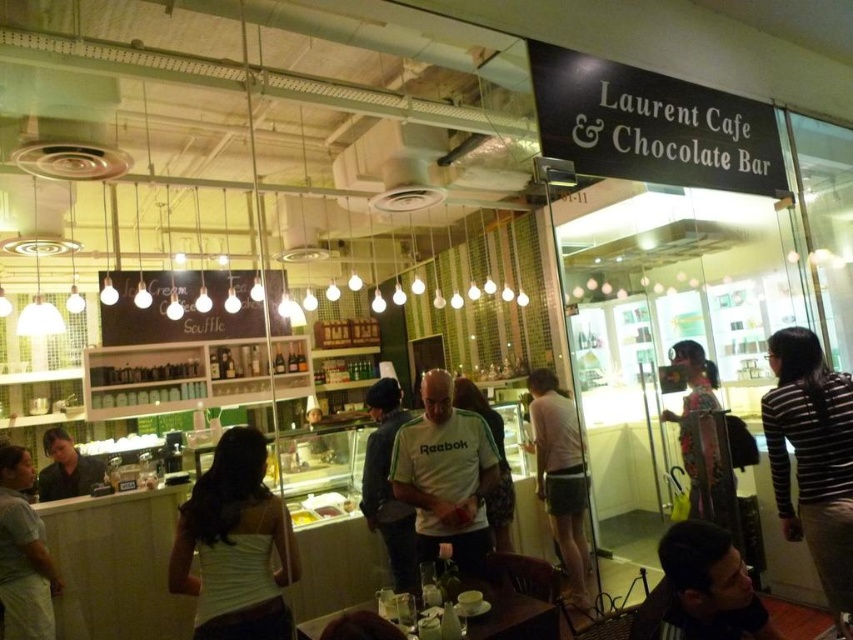
Question: Which object is the farthest from the striped sweater at right?

Choices:
 (A) white cotton shirt at center
 (B) white fabric tank top at center

Answer: (B)

Question: Is white fabric shirt at lower center positioned behind white cotton t-shirt at center?

Choices:
 (A) yes
 (B) no

Answer: (B)

Question: Can you confirm if white reebok shirt at center is thinner than white cotton t-shirt at center?

Choices:
 (A) no
 (B) yes

Answer: (B)

Question: Among these objects, which one is farthest from the camera?

Choices:
 (A) white cotton shirt at center
 (B) striped sweater at right
 (C) white fabric tank top at center

Answer: (A)

Question: Is white reebok shirt at center behind white cotton t-shirt at center?

Choices:
 (A) no
 (B) yes

Answer: (B)

Question: Among these objects, which one is farthest from the camera?

Choices:
 (A) white cotton shirt at center
 (B) white reebok shirt at center
 (C) white fabric shirt at lower center

Answer: (A)